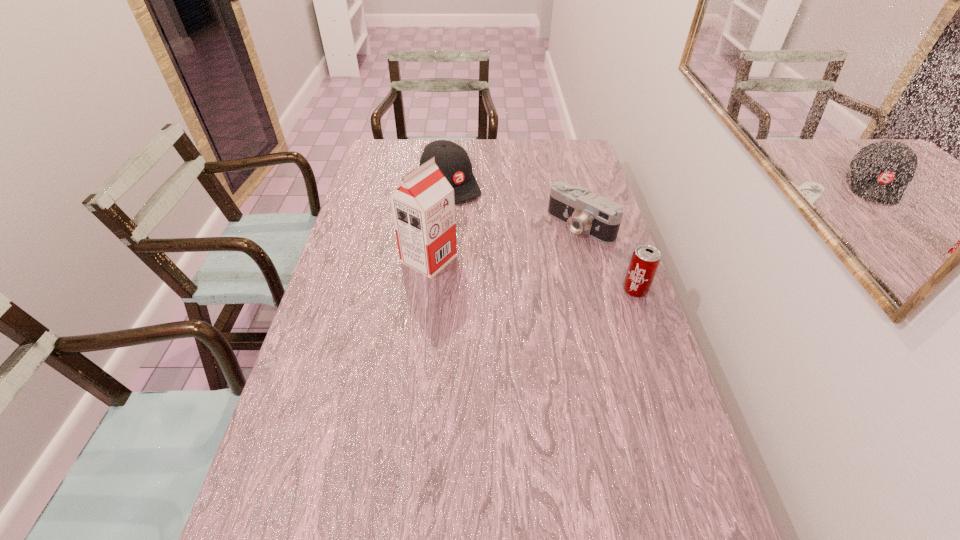
You are a GUI agent. You are given a task and a screenshot of the screen. Output one action in this format:
    pyautogui.click(x=<x>, y=<y>)
    Task: Click on the vacant space on the desktop that is between the soya milk and the nearest object and is positioned with a logo on the front of the farthest object
    
    Given the screenshot: What is the action you would take?
    pyautogui.click(x=540, y=276)

I want to click on vacant space on the desktop that is between the soya milk and the nearest object and is positioned on the lens of the shortest object, so click(x=522, y=273).